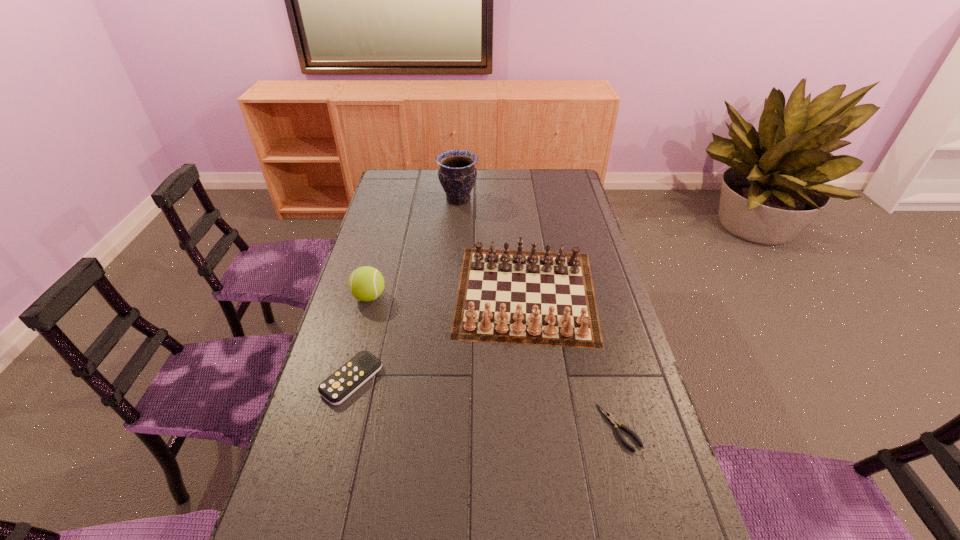
Where is `free space between the remote control and the tennis ball`? free space between the remote control and the tennis ball is located at coordinates (360, 338).

Locate an element on the screen. The width and height of the screenshot is (960, 540). free spot between the tennis ball and the chessboard is located at coordinates (447, 294).

Locate an element on the screen. free spot between the chessboard and the pliers is located at coordinates (572, 360).

What are the coordinates of `vacant area that lies between the tennis ball and the farthest object` in the screenshot? It's located at (414, 248).

The image size is (960, 540). In order to click on free area in between the second shortest object and the tennis ball in this screenshot , I will do `click(360, 338)`.

Identify the location of free space between the chessboard and the tennis ball. (447, 294).

At what (x,y) coordinates should I click in order to perform the action: click on vacant space in between the remote control and the farthest object. Please return your answer as a coordinate pair (x, y). The image size is (960, 540). Looking at the image, I should click on (405, 289).

Find the location of a particular element. blank region between the farthest object and the tennis ball is located at coordinates (414, 248).

Where is `free spot between the tennis ball and the chessboard`? This screenshot has width=960, height=540. free spot between the tennis ball and the chessboard is located at coordinates (447, 294).

I want to click on free space that is in between the pliers and the remote control, so click(486, 403).